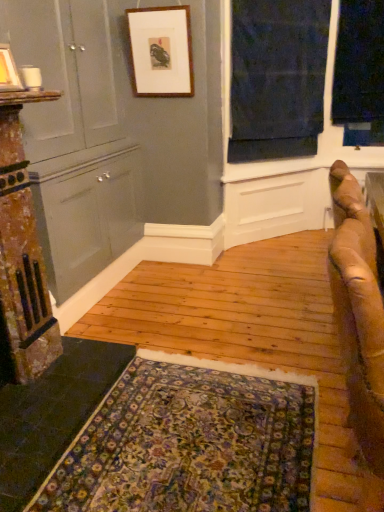
Question: Is dark blue fabric at upper right directly adjacent to matte gray dresser at left?

Choices:
 (A) yes
 (B) no

Answer: (B)

Question: Is dark blue fabric at upper right aimed at matte gray dresser at left?

Choices:
 (A) yes
 (B) no

Answer: (B)

Question: Is dark blue fabric at upper right outside of matte gray dresser at left?

Choices:
 (A) no
 (B) yes

Answer: (B)

Question: Can you confirm if dark blue fabric at upper right is positioned to the right of matte gray dresser at left?

Choices:
 (A) yes
 (B) no

Answer: (A)

Question: Is dark blue fabric at upper right positioned far away from matte gray dresser at left?

Choices:
 (A) yes
 (B) no

Answer: (B)

Question: Is point (183, 93) positioned closer to the camera than point (309, 450)?

Choices:
 (A) farther
 (B) closer

Answer: (A)

Question: Is wooden picture frame at upper center, arranged as the 1th picture frame when viewed from the back, to the left or to the right of floral carpet at lower center in the image?

Choices:
 (A) left
 (B) right

Answer: (A)

Question: Is wooden picture frame at upper center, arranged as the 1th picture frame when viewed from the right, bigger or smaller than floral carpet at lower center?

Choices:
 (A) small
 (B) big

Answer: (B)

Question: Is wooden picture frame at upper center, which appears as the first picture frame when viewed from the top, wider or thinner than floral carpet at lower center?

Choices:
 (A) wide
 (B) thin

Answer: (B)

Question: Is matte white picture frame at upper left, the first picture frame when ordered from front to back, wider or thinner than floral carpet at lower center?

Choices:
 (A) wide
 (B) thin

Answer: (B)

Question: From their relative heights in the image, would you say matte white picture frame at upper left, which is the first picture frame in bottom-to-top order, is taller or shorter than floral carpet at lower center?

Choices:
 (A) tall
 (B) short

Answer: (A)

Question: Is matte white picture frame at upper left, arranged as the 2th picture frame when viewed from the top, in front of or behind floral carpet at lower center in the image?

Choices:
 (A) behind
 (B) front

Answer: (A)

Question: Considering the positions of matte white picture frame at upper left, arranged as the 1th picture frame when viewed from the left, and floral carpet at lower center in the image, is matte white picture frame at upper left, arranged as the 1th picture frame when viewed from the left, bigger or smaller than floral carpet at lower center?

Choices:
 (A) big
 (B) small

Answer: (B)

Question: Visually, is floral carpet at lower center positioned to the left or to the right of dark blue fabric at upper right?

Choices:
 (A) right
 (B) left

Answer: (B)

Question: Does point (145, 362) appear closer or farther from the camera than point (284, 157)?

Choices:
 (A) closer
 (B) farther

Answer: (A)